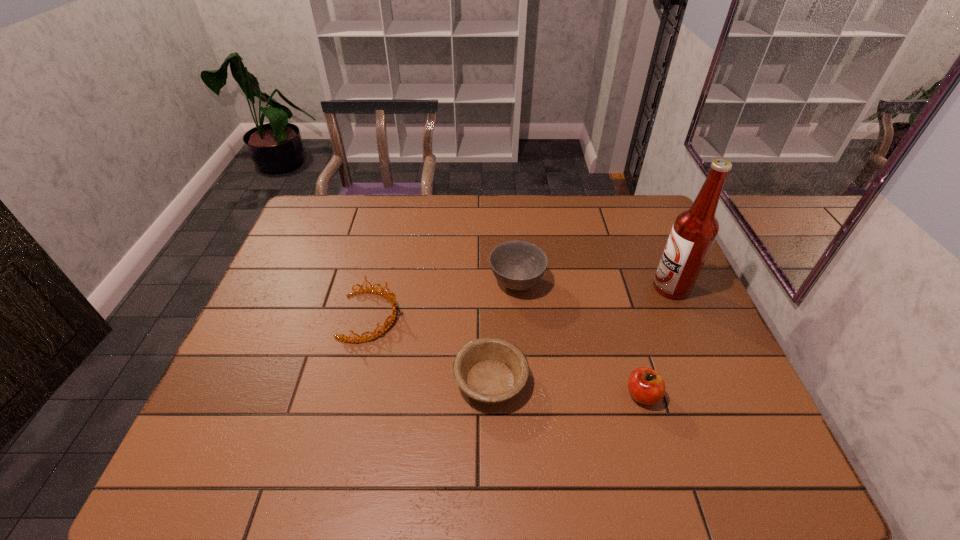
This screenshot has height=540, width=960. Identify the location of the third closest object to the rightmost object. tap(490, 370).

The width and height of the screenshot is (960, 540). What are the coordinates of `free space that satisfies the following two spatial constraints: 1. on the front-facing side of the leftmost object; 2. on the right side of the apple` in the screenshot? It's located at (351, 395).

Locate an element on the screen. This screenshot has width=960, height=540. vacant space that satisfies the following two spatial constraints: 1. on the front-facing side of the nearer bowl; 2. on the left side of the leftmost object is located at coordinates (355, 381).

Where is `free space that satisfies the following two spatial constraints: 1. on the front-facing side of the nearer bowl; 2. on the right side of the tiara`? free space that satisfies the following two spatial constraints: 1. on the front-facing side of the nearer bowl; 2. on the right side of the tiara is located at coordinates 355,381.

In order to click on free location that satisfies the following two spatial constraints: 1. on the front side of the taller bowl; 2. on the left side of the apple in this screenshot , I will do `click(526, 395)`.

What are the coordinates of `vacant area in the image that satisfies the following two spatial constraints: 1. on the front-facing side of the tiara; 2. on the back side of the shorter bowl` in the screenshot? It's located at (355, 381).